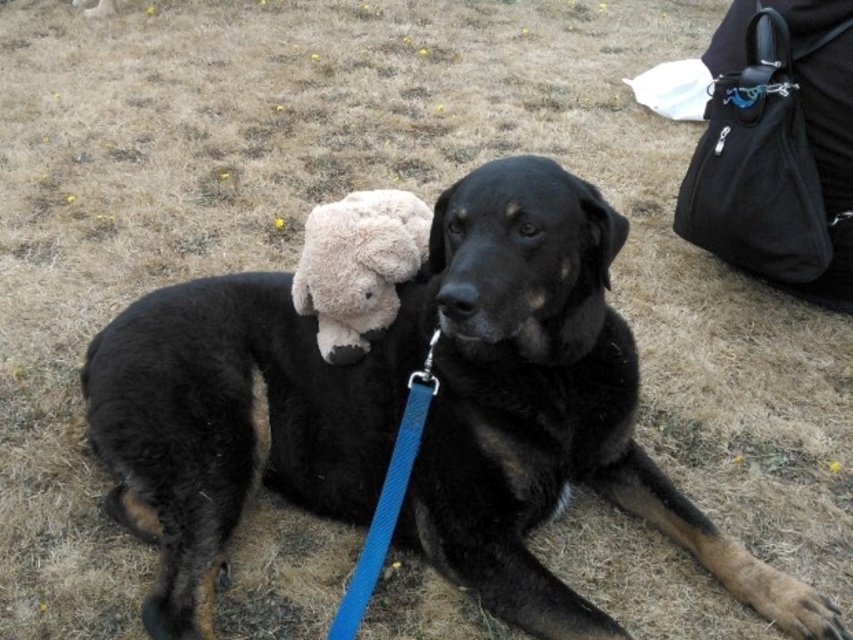
Question: Is the position of black soft fur dog at center less distant than that of fuzzy beige teddy bear at center?

Choices:
 (A) no
 (B) yes

Answer: (B)

Question: Does black soft fur dog at center have a greater width compared to fuzzy beige teddy bear at center?

Choices:
 (A) no
 (B) yes

Answer: (B)

Question: Is black soft fur dog at center behind fuzzy beige teddy bear at center?

Choices:
 (A) no
 (B) yes

Answer: (A)

Question: Among these points, which one is farthest from the camera?

Choices:
 (A) (316, 243)
 (B) (614, 472)

Answer: (B)

Question: Among these objects, which one is nearest to the camera?

Choices:
 (A) fuzzy beige teddy bear at center
 (B) black soft fur dog at center

Answer: (B)